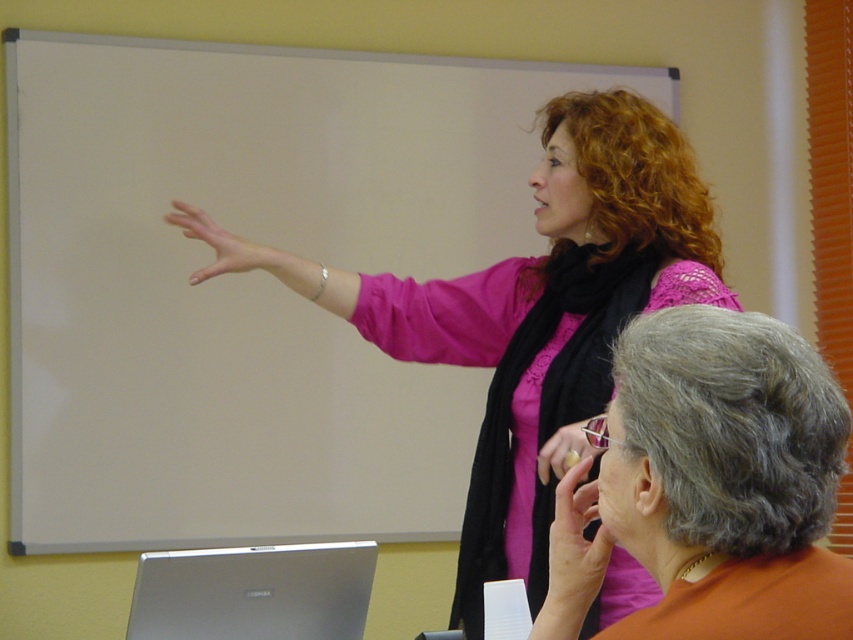
Question: Is silver metallic laptop at lower left closer to camera compared to matte pink hand at upper center?

Choices:
 (A) no
 (B) yes

Answer: (A)

Question: Which point is closer to the camera?

Choices:
 (A) smooth skin hand at upper right
 (B) matte black hand at upper center
 (C) matte pink blouse at center
 (D) pink matte/black scarf at upper center

Answer: (C)

Question: Can you confirm if pink matte/black scarf at upper center is positioned to the left of silver metallic laptop at lower left?

Choices:
 (A) no
 (B) yes

Answer: (A)

Question: Which point is closer to the camera?

Choices:
 (A) smooth skin hand at upper right
 (B) matte pink hand at upper center
 (C) matte black hand at upper center

Answer: (A)

Question: Which of these objects is positioned closest to the matte pink hand at upper center?

Choices:
 (A) silver metallic laptop at lower left
 (B) smooth skin hand at upper right
 (C) matte pink blouse at center
 (D) matte black hand at upper center

Answer: (A)

Question: Does pink matte/black scarf at upper center have a smaller size compared to matte pink blouse at center?

Choices:
 (A) no
 (B) yes

Answer: (A)